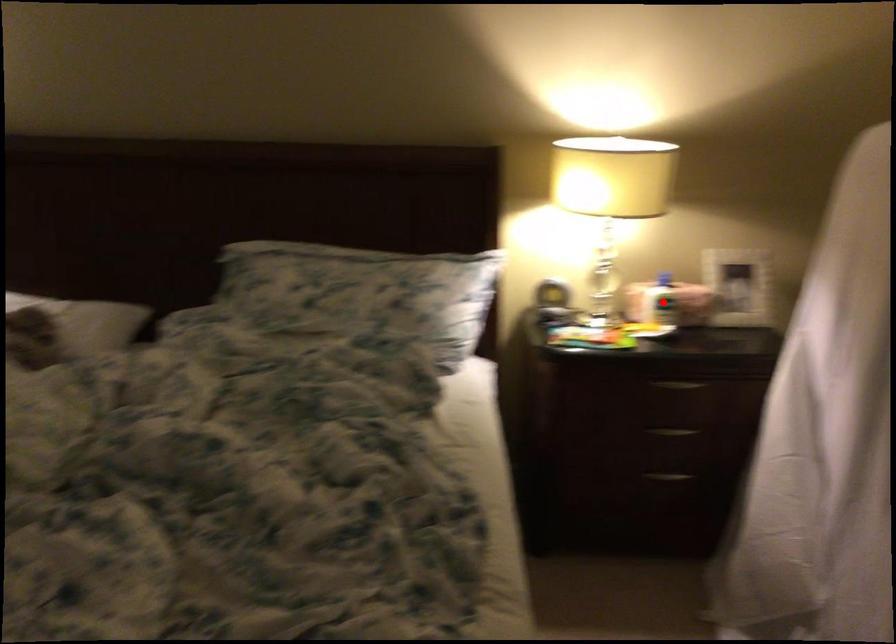
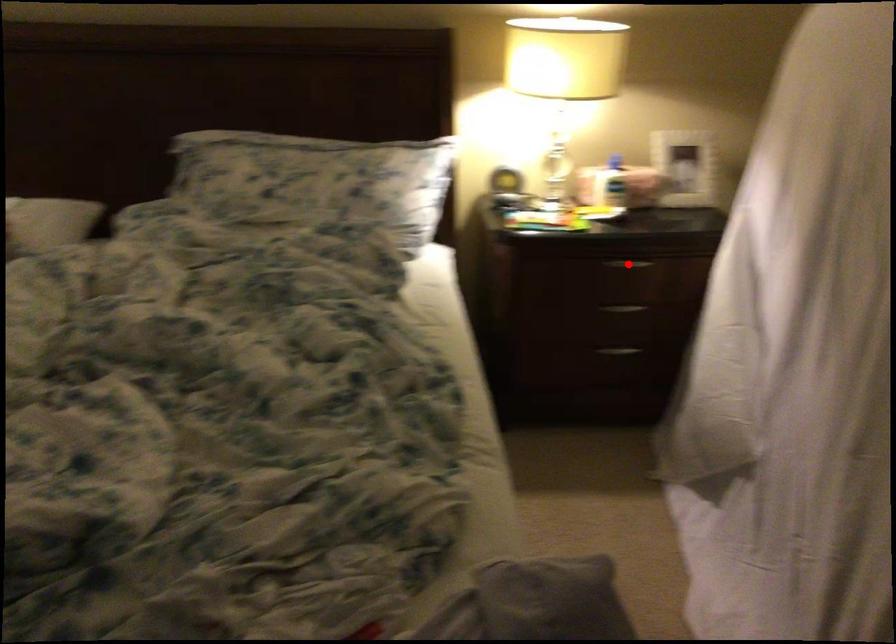
From the picture: I am providing you with two images of the same scene from different viewpoints. A red point is marked on the first image and another point is marked on the second image. Is the red point in image1 aligned with the point shown in image2?

No